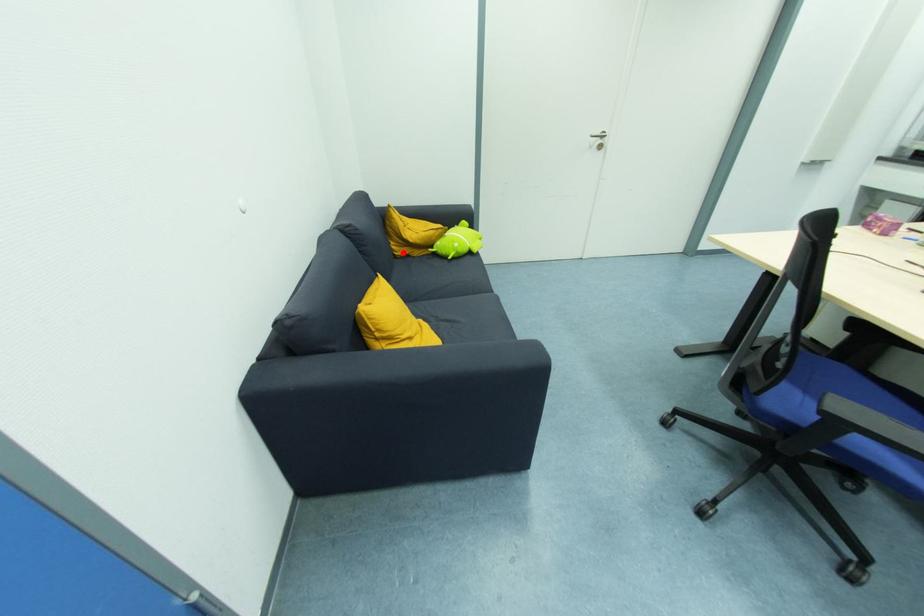
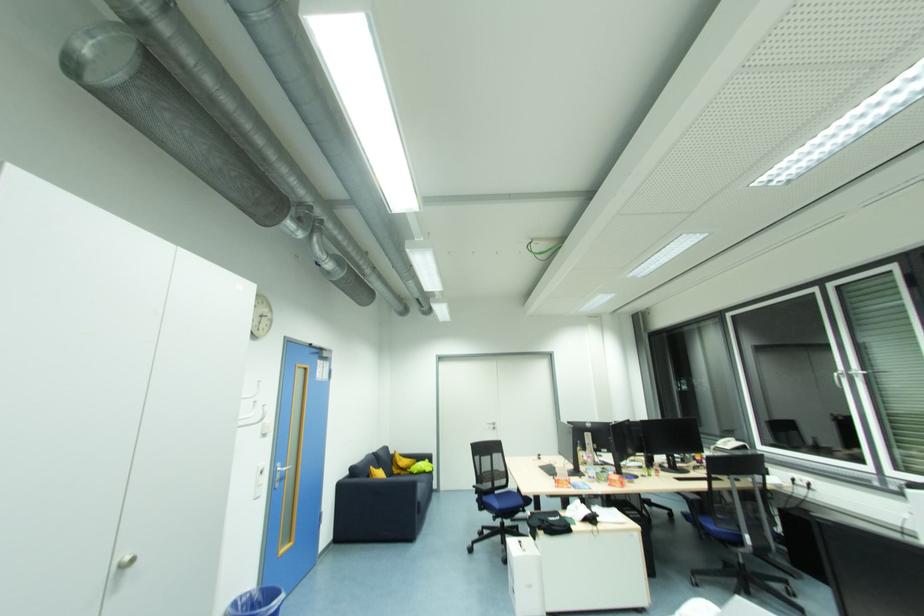
The point at the highlighted location is marked in the first image. Where is the corresponding point in the second image?

(398, 472)